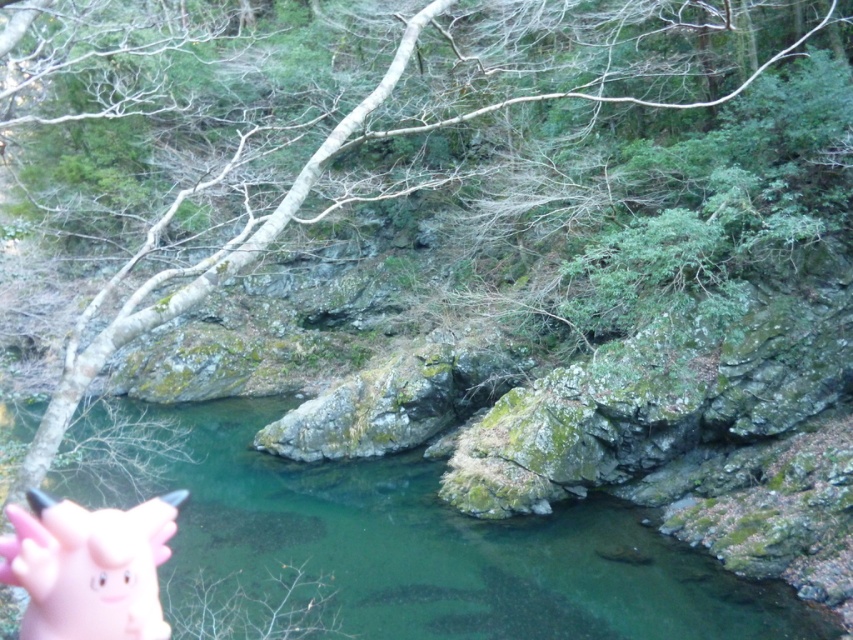
What do you see at coordinates (403, 541) in the screenshot? This screenshot has height=640, width=853. I see `green mossy rock at center` at bounding box center [403, 541].

Is point (422, 499) farther from viewer compared to point (22, 532)?

Yes, it is behind point (22, 532).

At what (x,y) coordinates should I click in order to perform the action: click on green mossy rock at center. Please return your answer as a coordinate pair (x, y). Looking at the image, I should click on (403, 541).